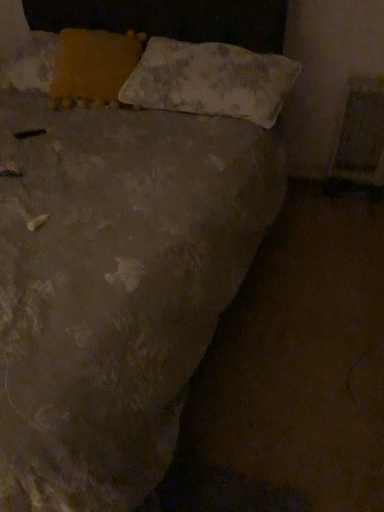
Question: Considering the positions of yellow fabric pillow at upper left, the second pillow from the right, and faded fabric pillow at upper center, placed as the first pillow when sorted from right to left, in the image, is yellow fabric pillow at upper left, the second pillow from the right, bigger or smaller than faded fabric pillow at upper center, placed as the first pillow when sorted from right to left,?

Choices:
 (A) small
 (B) big

Answer: (A)

Question: Is yellow fabric pillow at upper left, the second pillow from the right, wider or thinner than faded fabric pillow at upper center, placed as the first pillow when sorted from right to left?

Choices:
 (A) thin
 (B) wide

Answer: (A)

Question: Does point coord(82,50) appear closer or farther from the camera than point coord(271,76)?

Choices:
 (A) farther
 (B) closer

Answer: (A)

Question: Looking at their shapes, would you say faded fabric pillow at upper center, placed as the first pillow when sorted from right to left, is wider or thinner than yellow fabric pillow at upper left, the second pillow from the right?

Choices:
 (A) wide
 (B) thin

Answer: (A)

Question: Would you say faded fabric pillow at upper center, placed as the first pillow when sorted from right to left, is to the left or to the right of yellow fabric pillow at upper left, the second pillow from the right, in the picture?

Choices:
 (A) left
 (B) right

Answer: (B)

Question: Is faded fabric pillow at upper center, placed as the second pillow when sorted from left to right, in front of or behind yellow fabric pillow at upper left, the 1th pillow positioned from the left, in the image?

Choices:
 (A) front
 (B) behind

Answer: (A)

Question: Based on their sizes in the image, would you say faded fabric pillow at upper center, placed as the second pillow when sorted from left to right, is bigger or smaller than yellow fabric pillow at upper left, the second pillow from the right?

Choices:
 (A) small
 (B) big

Answer: (B)